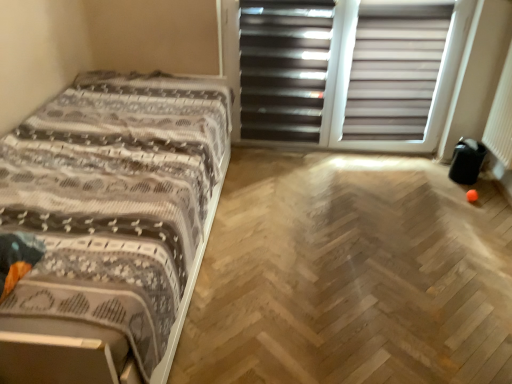
Image resolution: width=512 pixels, height=384 pixels. I want to click on free space in front of white plastic blinds at upper center, arranged as the first screen door when viewed from the right, so click(302, 218).